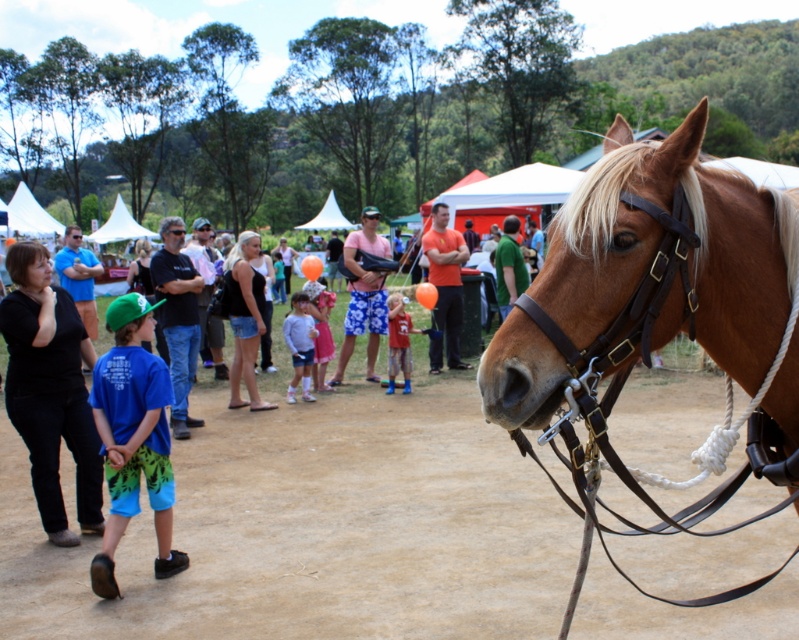
Looking at this image, you are standing at the point marked as point [133,436] in the image. What object are you standing on?

You are standing on the blue fabric shorts at lower left.

You are a photographer standing near the camera in the scene. You want to take a photo of the blue fabric shorts at lower left. Is the distance between you and the shorts sufficient to capture a clear, detailed photo with your standard camera lens?

The blue fabric shorts at lower left and the camera are 4.91 meters apart. With a standard camera lens, this distance is sufficient to capture a clear, detailed photo as most standard lenses can focus effectively at this range.

You are organizing a small picnic at the community event and need to place a picnic blanket. Given the brown dirt field at center and the floral shorts at center, which area can accommodate the blanket without overlapping either object?

The brown dirt field at center has a smaller size compared to floral shorts at center, so the floral shorts at center is larger and can accommodate the picnic blanket without overlapping.